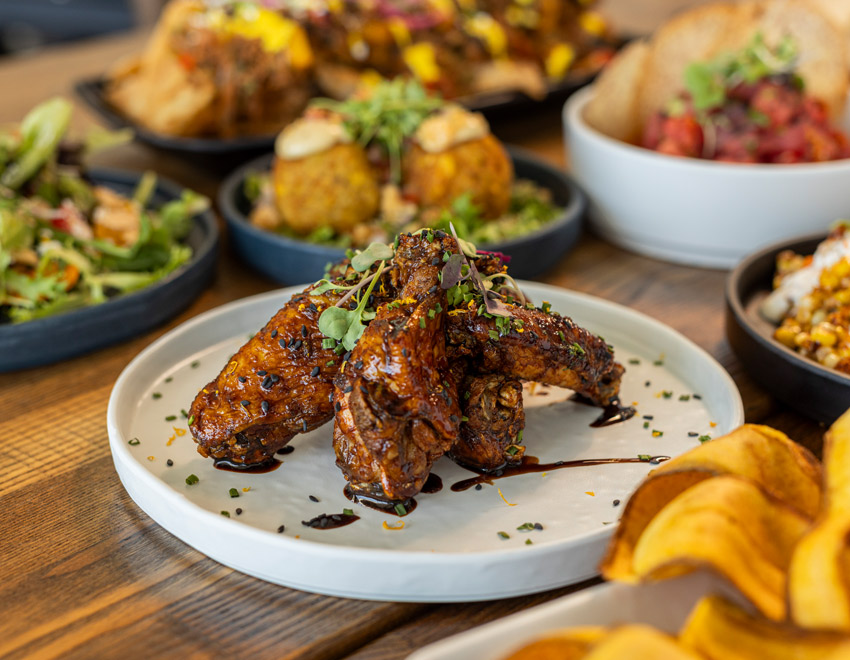
Find the location of `black serving dish`. black serving dish is located at coordinates (516, 104).